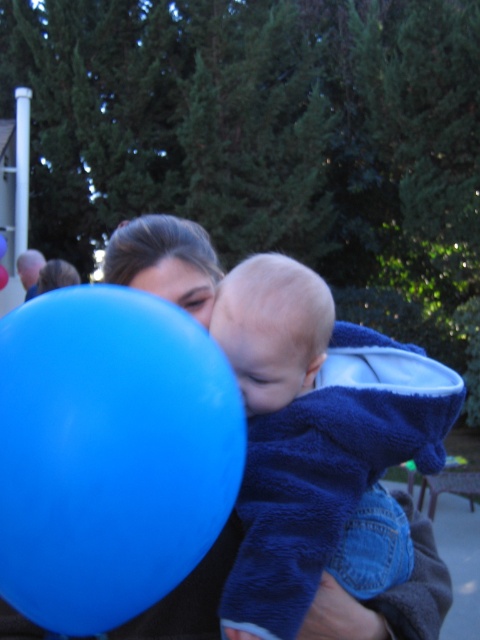
Consider the image. You are a photographer at a party and want to capture a clear shot of the blue soft towel at center without the blue rubber balloon at left blocking it. How should you adjust your position?

Move to the right side so that the blue rubber balloon at left no longer blocks the blue soft towel at center.

You are a photographer trying to capture a clear shot of both the blue rubber balloon at left and the smooth skin face at center. Since the balloon is wider than the face, how should you adjust your camera angle to ensure both are fully visible in the frame?

Since the blue rubber balloon at left is wider than the smooth skin face at center, you should position your camera so that the balloon and face are aligned horizontally, ensuring the wider balloon doesn not block the face while framing both within the shot.

Based on the photo, you are organizing a photo shoot and need to ensure the blue soft towel at center is positioned exactly at point (312, 429). Can you confirm if the blue soft towel at center is already at the correct coordinates?

Yes, the blue soft towel at center is located at point (312, 429), so it is already positioned correctly.